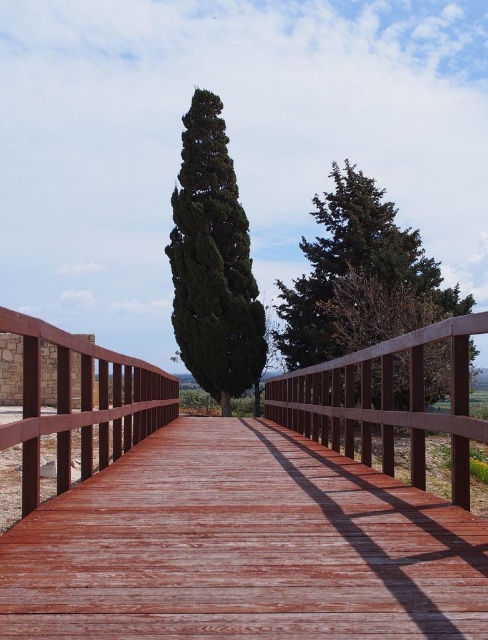
You are standing at the starting point of the wooden walkway and want to reach the wooden bridge at center. According to the coordinates provided, in which direction should you walk to reach it?

The wooden bridge at center is located at coordinates point (243, 508). Since you are at the starting point, you should walk forward along the walkway towards the center to reach the wooden bridge at center.

You are a hiker standing on the wooden walkway and want to cross to the other side. There is a wooden bridge at center and a green textured tree at upper center. Which object is closer to you?

The wooden bridge at center is closer to the viewer than the green textured tree at upper center.